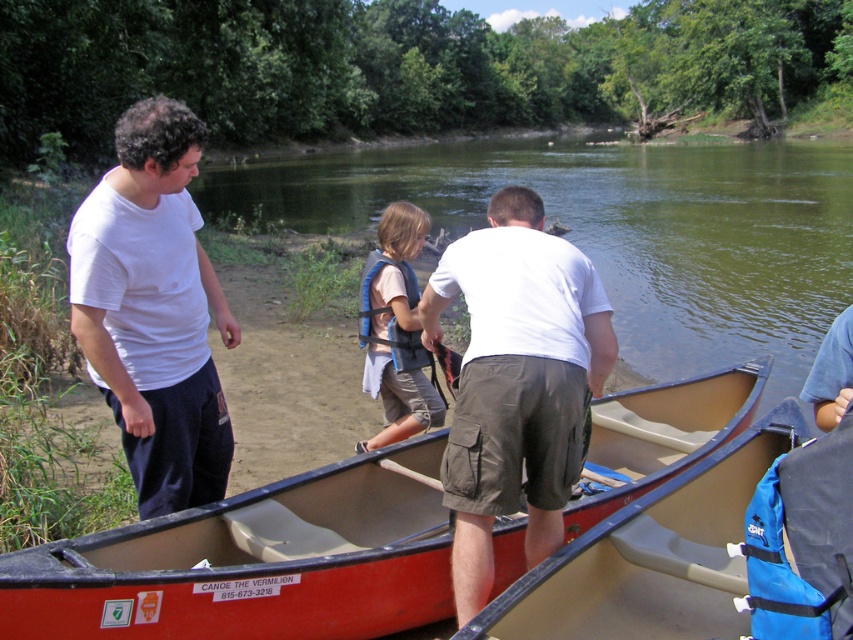
You are standing at the point closest to the camera. Which point is closer to you? The point at coordinate (187, 346) or the point at (370, 390)?

The point at coordinate (187, 346) is closer to you because it is in front of the point at (370, 390).